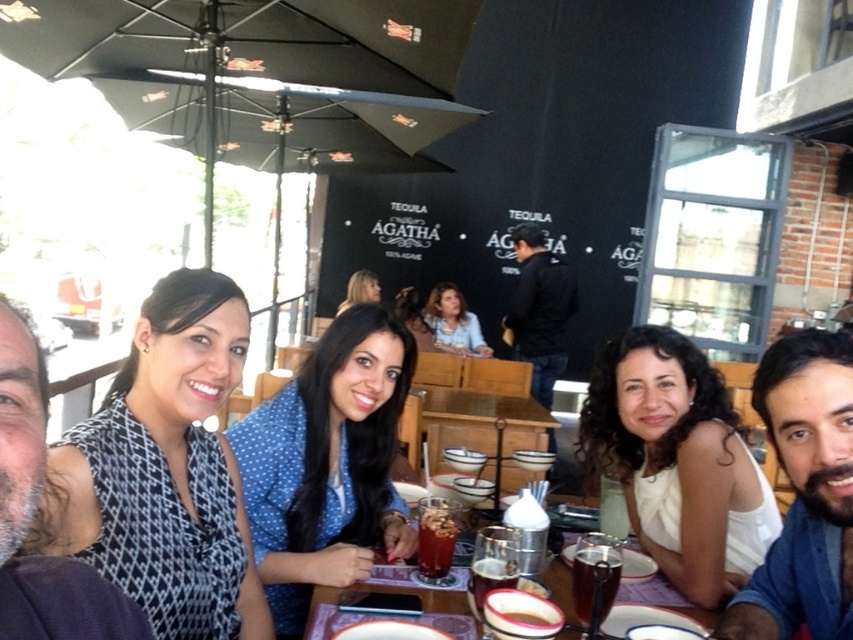
In the scene at Agatha restaurant, there are two people wearing the black houndstooth dress at upper left and the matte blue shirt at center. Which one is positioned to the left?

The black houndstooth dress at upper left is to the left of matte blue shirt at center.

Looking at this image, you are a photographer trying to capture a group photo of the people at the table. You notice two points marked in the scene. Which point is closer to the camera? Please choose between point (672, 371) and point (460, 592).

Point (672, 371) is further to the camera than point (460, 592), so the closer point to the camera is point (460, 592).

You are a photographer standing behind the camera. You notice the black houndstooth dress at upper left and the matte blue shirt at center. Which one is positioned closer to you?

The black houndstooth dress at upper left is closer to the viewer than the matte blue shirt at center.